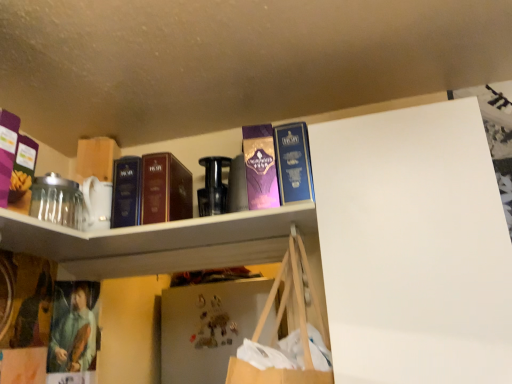
Question: Does point (159, 215) appear closer or farther from the camera than point (123, 175)?

Choices:
 (A) closer
 (B) farther

Answer: (A)

Question: Based on their positions, is matte brown book at upper center, arranged as the second book when viewed from the right, located to the left or right of dark blue hardcover book at center, the first book from the left?

Choices:
 (A) left
 (B) right

Answer: (B)

Question: Which object is the farthest from the purple matte box at upper left?

Choices:
 (A) metallic black bottle at center
 (B) metallic gold magnet at center
 (C) purple glossy paperback book at upper center
 (D) blue hardcover book at upper center, placed as the 3th book when sorted from left to right
 (E) dark blue hardcover book at center, marked as the third book in a right-to-left arrangement

Answer: (B)

Question: Which object is positioned closest to the matte brown book at upper center, arranged as the second book when viewed from the right?

Choices:
 (A) dark blue hardcover book at center, marked as the third book in a right-to-left arrangement
 (B) purple glossy paperback book at upper center
 (C) metallic gold magnet at center
 (D) white glossy shelf at upper center
 (E) purple matte box at upper left

Answer: (A)